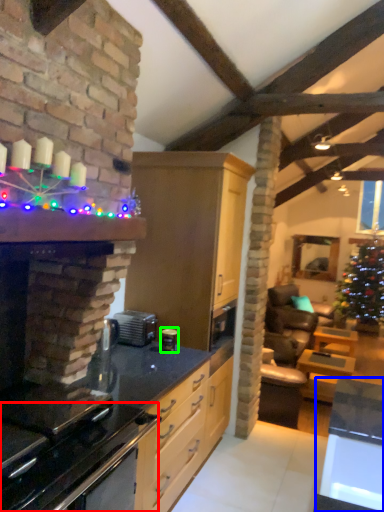
Question: Considering the real-world distances, which object is farthest from oven (highlighted by a red box)? table (highlighted by a blue box) or appliance (highlighted by a green box)?

Choices:
 (A) table
 (B) appliance

Answer: (B)